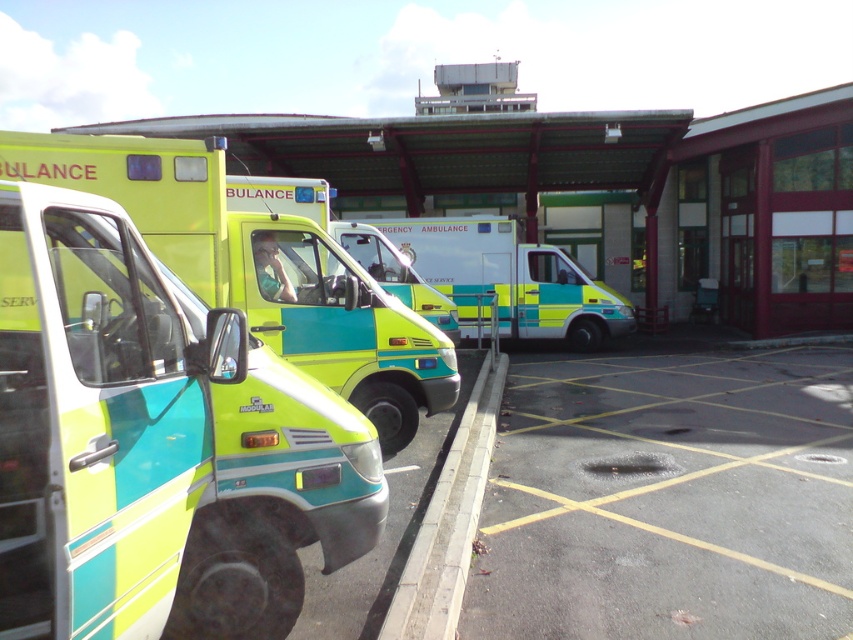
Question: Can you confirm if matte green and blue ambulance at left is positioned to the left of dark gray asphalt at lower right?

Choices:
 (A) no
 (B) yes

Answer: (B)

Question: Which object is closer to the camera taking this photo?

Choices:
 (A) dark gray asphalt at lower right
 (B) matte green and yellow ambulance at center
 (C) matte green ambulance at center

Answer: (A)

Question: Can you confirm if matte green and blue ambulance at left is positioned above dark gray asphalt at lower right?

Choices:
 (A) yes
 (B) no

Answer: (A)

Question: Is matte green and blue ambulance at left positioned in front of dark gray asphalt at lower right?

Choices:
 (A) yes
 (B) no

Answer: (A)

Question: Which is nearer to the matte green and yellow ambulance at center?

Choices:
 (A) yellow-green plastic ambulance at center
 (B) matte green and blue ambulance at left
 (C) dark gray asphalt at lower right

Answer: (B)

Question: Which point is farther to the camera?

Choices:
 (A) (167, 202)
 (B) (296, 433)

Answer: (A)